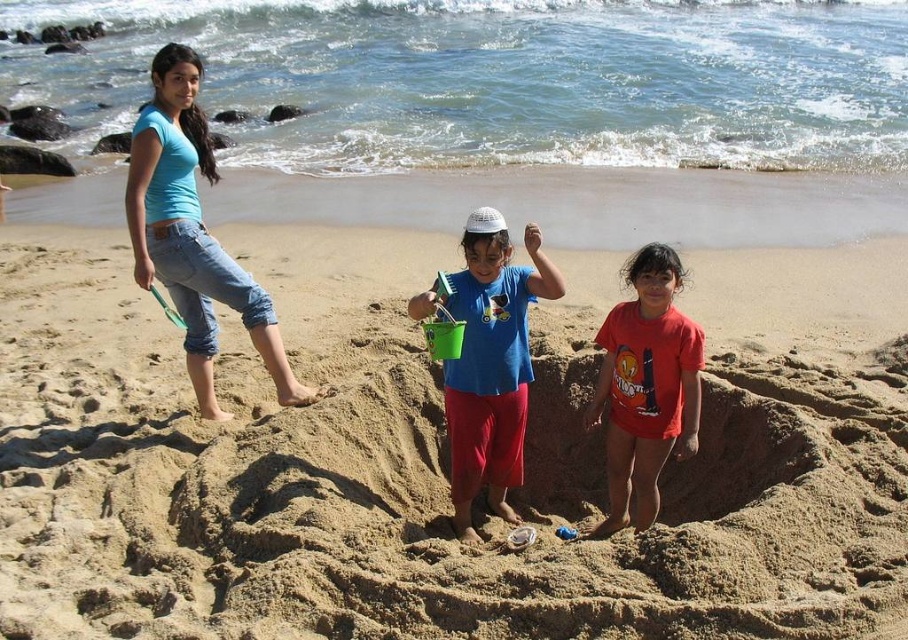
Question: Among these points, which one is nearest to the camera?

Choices:
 (A) pyautogui.click(x=467, y=412)
 (B) pyautogui.click(x=650, y=433)
 (C) pyautogui.click(x=130, y=321)

Answer: (B)

Question: Is blue matte shirt at center further to the viewer compared to red cotton shirt at center?

Choices:
 (A) yes
 (B) no

Answer: (A)

Question: Which is farther from the matte blue t-shirt at upper left?

Choices:
 (A) blue matte shirt at center
 (B) beige sand at center

Answer: (B)

Question: Which of these objects is positioned farthest from the red cotton shirt at center?

Choices:
 (A) beige sand at center
 (B) matte blue t-shirt at upper left

Answer: (B)

Question: Is blue matte shirt at center to the right of red cotton shirt at center from the viewer's perspective?

Choices:
 (A) yes
 (B) no

Answer: (B)

Question: Can you confirm if matte blue t-shirt at upper left is positioned to the left of blue matte shirt at center?

Choices:
 (A) no
 (B) yes

Answer: (B)